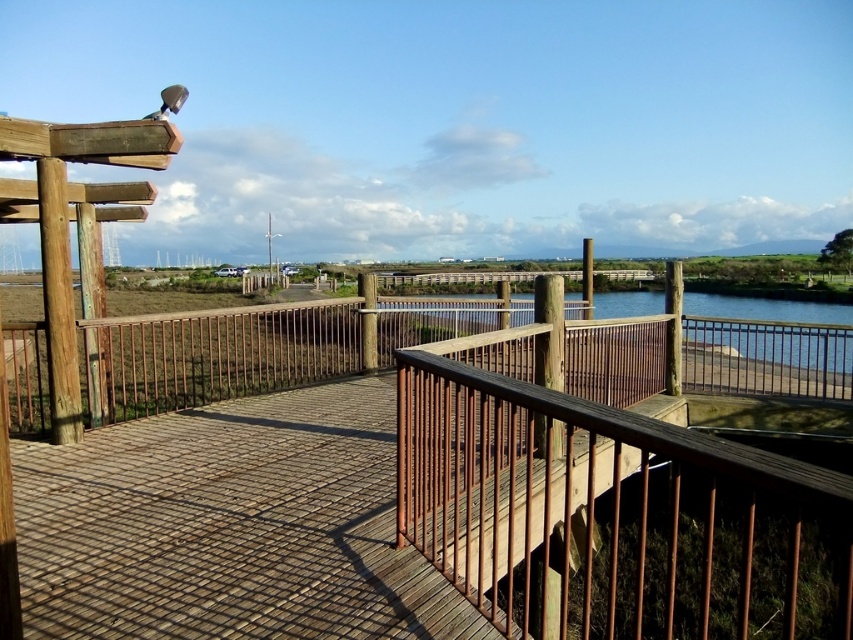
Question: Is the position of rustic wood railing at center less distant than that of clear blue water at center?

Choices:
 (A) no
 (B) yes

Answer: (B)

Question: Can you confirm if rustic wood railing at center is wider than clear blue water at center?

Choices:
 (A) yes
 (B) no

Answer: (B)

Question: Which point is closer to the camera?

Choices:
 (A) rustic wood railing at center
 (B) clear blue water at center

Answer: (A)

Question: Is rustic wood railing at center to the right of clear blue water at center from the viewer's perspective?

Choices:
 (A) no
 (B) yes

Answer: (A)

Question: Which point is farther from the camera taking this photo?

Choices:
 (A) (701, 310)
 (B) (614, 348)

Answer: (A)

Question: Which object appears closest to the camera in this image?

Choices:
 (A) clear blue water at center
 (B) rustic wood railing at center

Answer: (B)